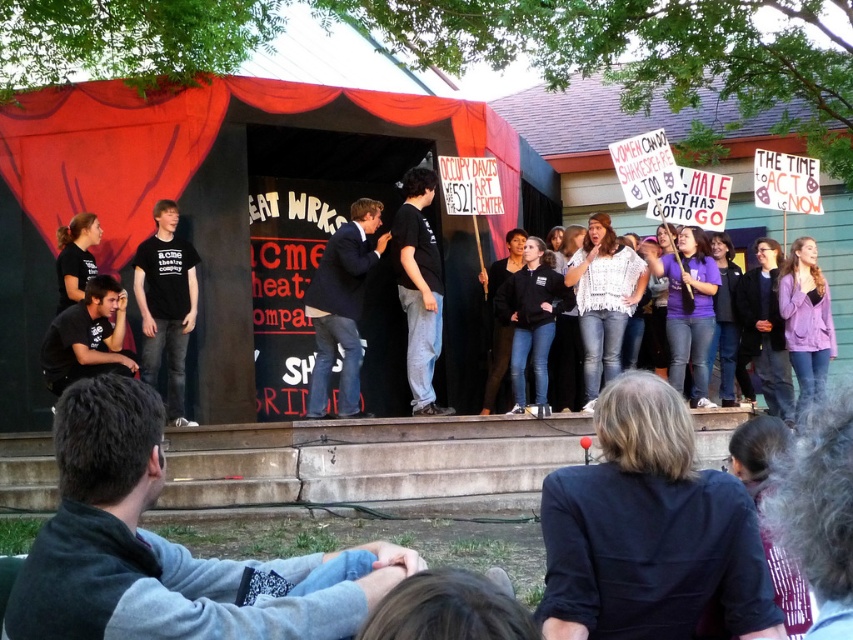
Is dark blue suit at center thinner than black cotton shirt at center?

No.

Is dark blue suit at center positioned at the back of black cotton shirt at center?

That is False.

Between point (357, 275) and point (407, 214), which one is positioned in front?

Point (357, 275) is in front.

At what (x,y) coordinates should I click in order to perform the action: click on dark blue suit at center. Please return your answer as a coordinate pair (x, y). Looking at the image, I should click on (341, 307).

Is dark blue suit at center above black cotton t-shirt at left?

Indeed, dark blue suit at center is positioned over black cotton t-shirt at left.

Does dark blue suit at center have a smaller size compared to black cotton t-shirt at left?

Actually, dark blue suit at center might be larger than black cotton t-shirt at left.

The image size is (853, 640). Identify the location of dark blue suit at center. (341, 307).

This screenshot has width=853, height=640. What are the coordinates of `dark blue suit at center` in the screenshot? It's located at (341, 307).

Is black cotton t-shirt at left wider than black cotton shirt at center?

No.

What are the coordinates of `black cotton t-shirt at left` in the screenshot? It's located at (166, 305).